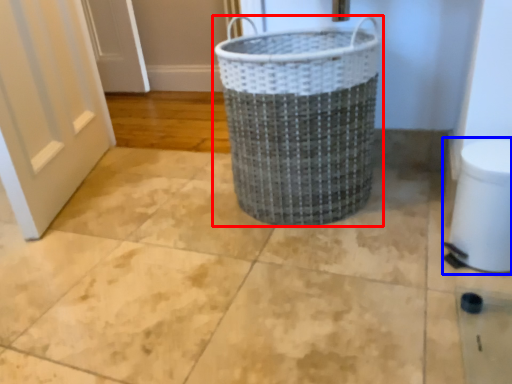
Question: Which of the following is the farthest to the observer, waste container (highlighted by a red box) or toilet bowl (highlighted by a blue box)?

Choices:
 (A) waste container
 (B) toilet bowl

Answer: (A)